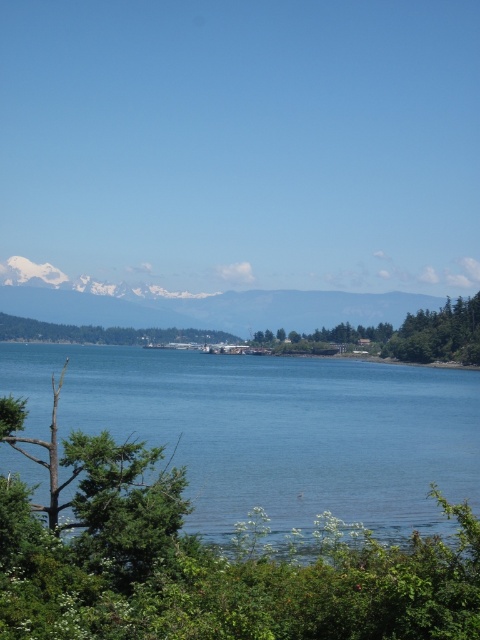
Question: Estimate the real-world distances between objects in this image. Which object is closer to the blue liquid water at center?

Choices:
 (A) snowy white mountain at upper center
 (B) green leafy tree at center
 (C) green leafy trees at center

Answer: (C)

Question: Which object is positioned closest to the blue liquid water at center?

Choices:
 (A) snowy white mountain at upper center
 (B) green leafy trees at center

Answer: (B)

Question: Is green leafy trees at center to the right of green leafy tree at center from the viewer's perspective?

Choices:
 (A) no
 (B) yes

Answer: (B)

Question: Is the position of blue liquid water at center less distant than that of snowy white mountain at upper center?

Choices:
 (A) yes
 (B) no

Answer: (A)

Question: Considering the real-world distances, which object is farthest from the green leafy trees at center?

Choices:
 (A) blue liquid water at center
 (B) snowy white mountain at upper center

Answer: (B)

Question: Is snowy white mountain at upper center to the left of green leafy tree at center from the viewer's perspective?

Choices:
 (A) yes
 (B) no

Answer: (B)